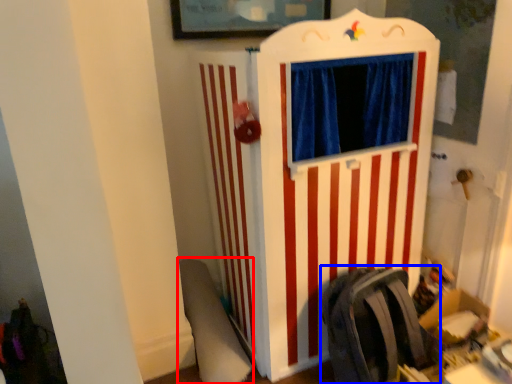
Question: Which point is further to the camera, swivel chair (highlighted by a red box) or folding chair (highlighted by a blue box)?

Choices:
 (A) swivel chair
 (B) folding chair

Answer: (A)